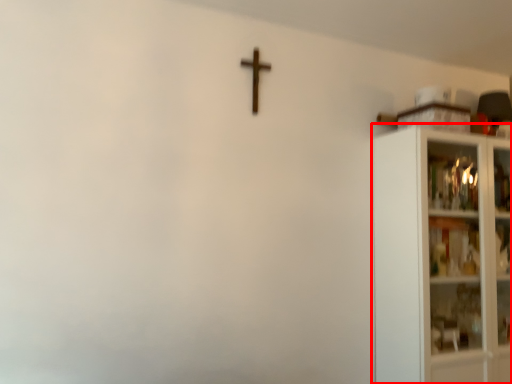
Question: From the image's perspective, where is shelf (annotated by the red box) located in relation to crucifix in the image?

Choices:
 (A) below
 (B) above

Answer: (A)